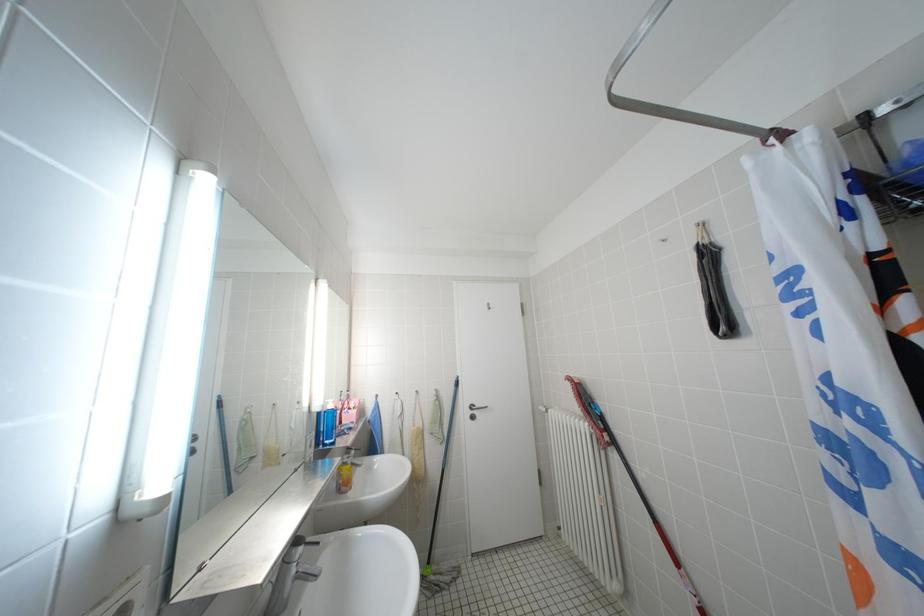
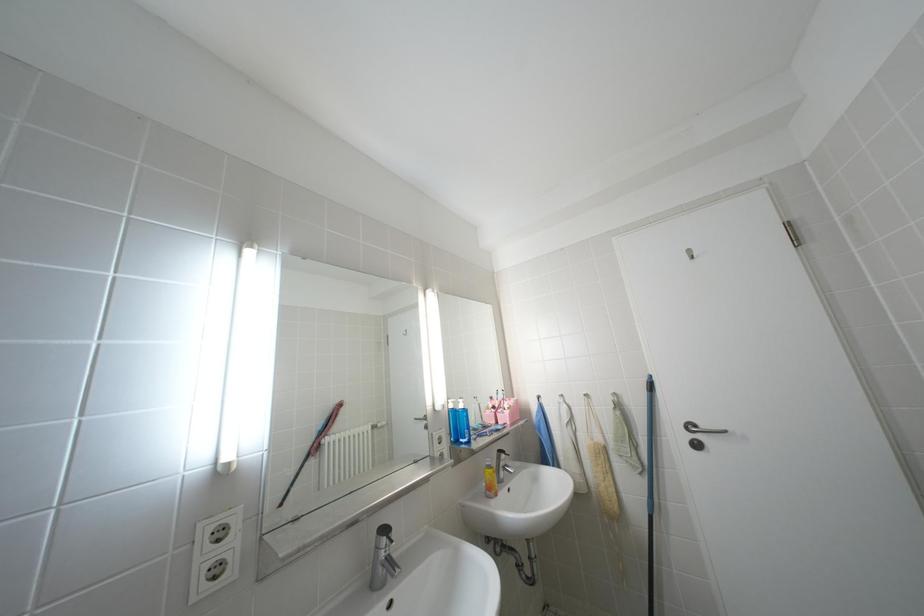
Question: How did the camera likely rotate?

Choices:
 (A) Left
 (B) Right
 (C) Up
 (D) Down

Answer: (A)